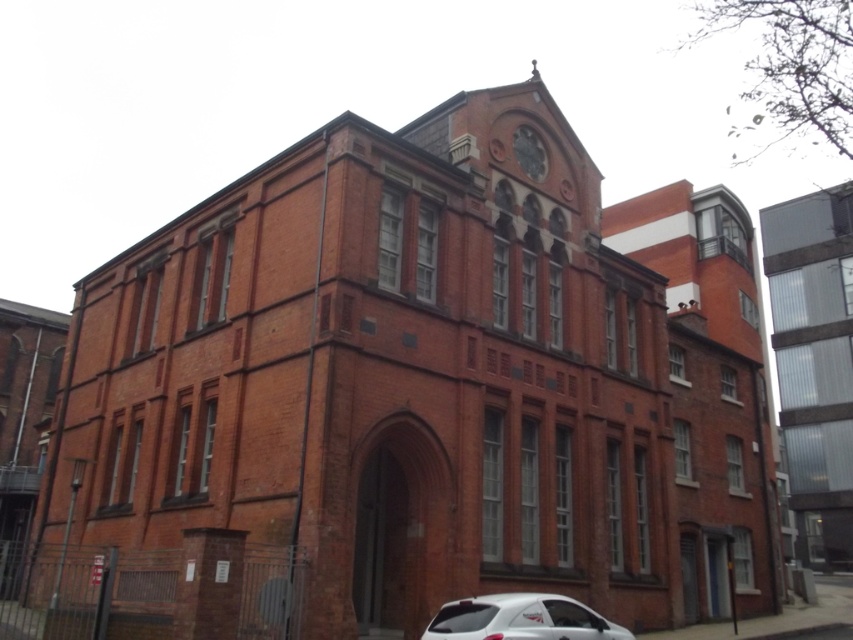
You are a delivery person trying to park your white glossy car at lower center near the clear glass building at right. Considering the height difference between them, will the car fit under the building without any issues?

The clear glass building at right is much taller than the white glossy car at lower center, so the car will fit under the building without any issues.

You are standing in front of the red brick building and want to park your white glossy car at lower center near the clear glass building at right. Is there enough space between them for the car to fit sideways?

The clear glass building at right might be wider than white glossy car at lower center, so there may not be enough space for the car to fit sideways between them.